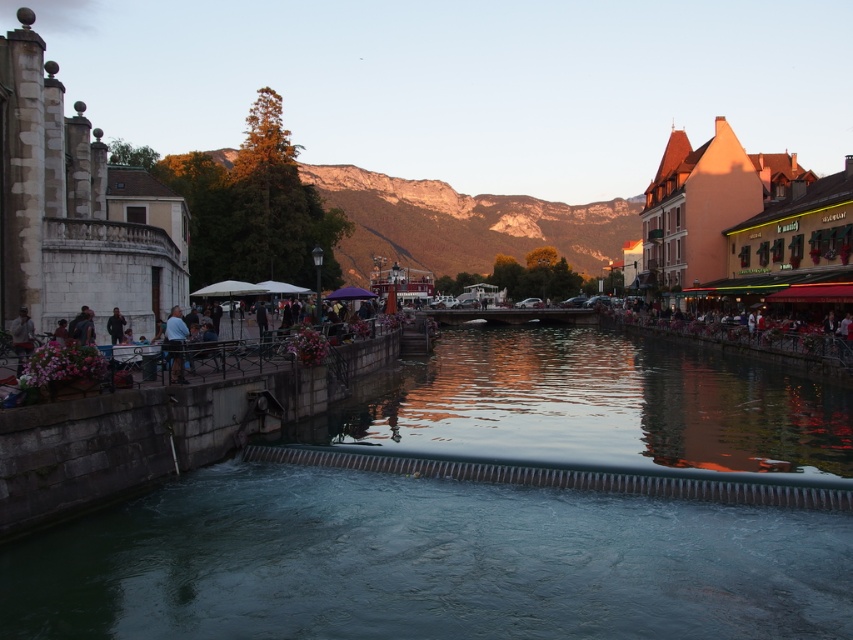
Question: Among these points, which one is nearest to the camera?

Choices:
 (A) (19, 326)
 (B) (405, 387)

Answer: (A)

Question: Which object appears closest to the camera in this image?

Choices:
 (A) light blue jeans at left
 (B) light brown leather jacket at lower left
 (C) dark blue jeans at left
 (D) rustic stone mountain at upper center

Answer: (B)

Question: Where is smooth concrete river at center located in relation to matte orange building at right in the image?

Choices:
 (A) left
 (B) right

Answer: (A)

Question: Can you confirm if matte orange building at right is thinner than light blue jeans at left?

Choices:
 (A) no
 (B) yes

Answer: (A)

Question: Can you confirm if rustic stone mountain at upper center is smaller than matte orange building at right?

Choices:
 (A) yes
 (B) no

Answer: (B)

Question: Which of the following is the closest to the observer?

Choices:
 (A) 120,332
 (B) 844,525

Answer: (B)